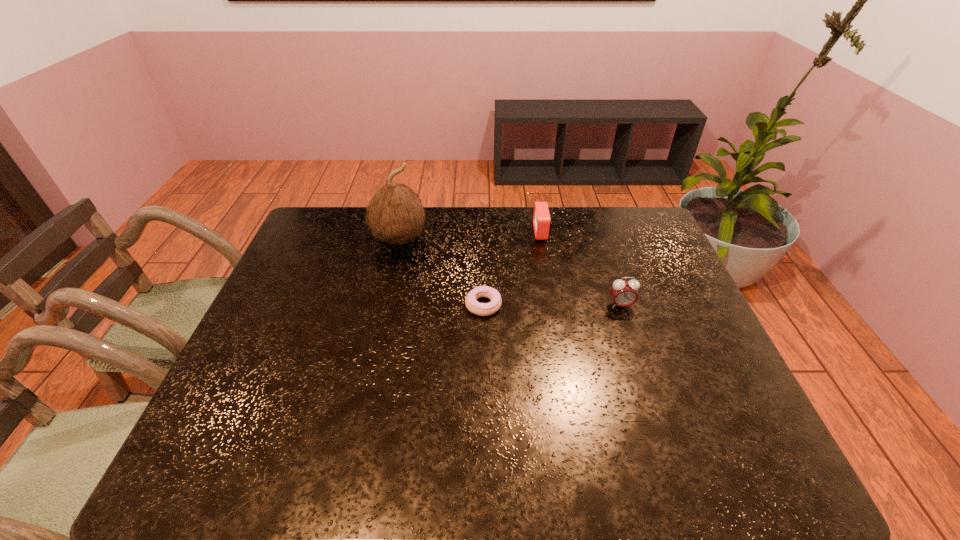
Where is `free space located 0.100m on the front-facing side of the third object from left to right`? The height and width of the screenshot is (540, 960). free space located 0.100m on the front-facing side of the third object from left to right is located at coordinates (504, 232).

Identify the location of vacant space located 0.130m on the front-facing side of the third object from left to right. The image size is (960, 540). (494, 232).

The height and width of the screenshot is (540, 960). In order to click on vacant region located on the front-facing side of the third object from left to right in this screenshot , I will do `click(447, 232)`.

At what (x,y) coordinates should I click in order to perform the action: click on vacant space situated 0.120m on the back of the doughnut. Please return your answer as a coordinate pair (x, y). The height and width of the screenshot is (540, 960). Looking at the image, I should click on (483, 265).

Identify the location of coconut located at the far edge. (395, 213).

Identify the location of alarm clock at the far edge. The width and height of the screenshot is (960, 540). (542, 223).

What are the coordinates of `free space at the far edge of the desktop` in the screenshot? It's located at (443, 208).

Identify the location of free region at the near edge of the desktop. (660, 448).

This screenshot has width=960, height=540. In order to click on vacant position at the left edge of the desktop in this screenshot , I will do `click(288, 322)`.

Locate an element on the screen. This screenshot has width=960, height=540. free spot at the right edge of the desktop is located at coordinates (656, 351).